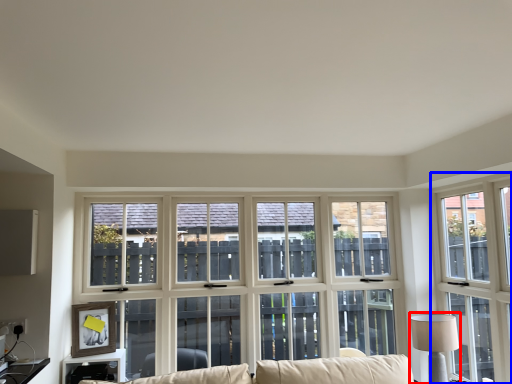
Question: Among these objects, which one is nearest to the camera, table lamp (highlighted by a red box) or window (highlighted by a blue box)?

Choices:
 (A) table lamp
 (B) window

Answer: (B)